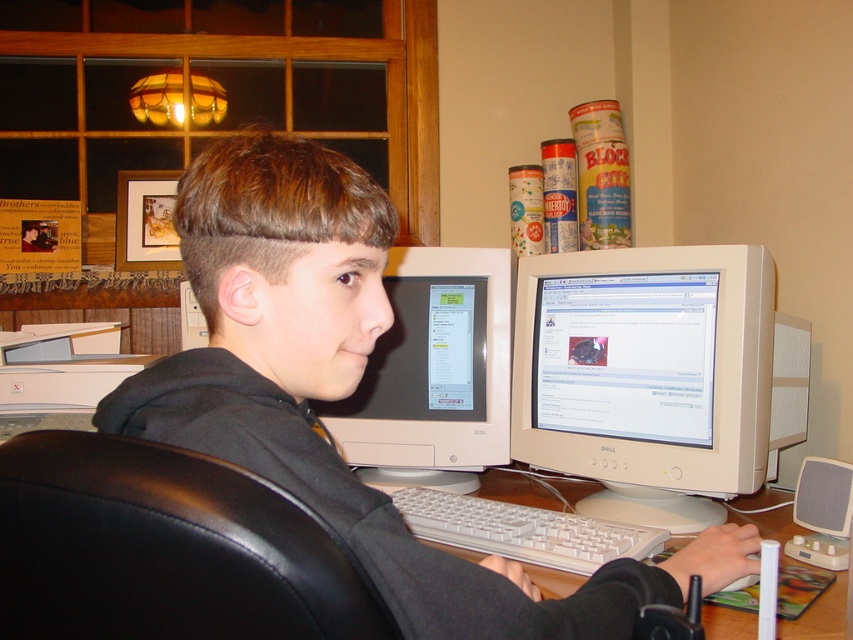
Based on the photo, which is more to the right, matte black hoodie at center or white glossy monitor at center?

matte black hoodie at center

Is point (567, 616) in front of point (480, 369)?

Yes, it is in front of point (480, 369).

The width and height of the screenshot is (853, 640). I want to click on matte black hoodie at center, so click(344, 392).

Can you confirm if matte black hoodie at center is shorter than white plastic monitor at center?

Incorrect, matte black hoodie at center's height does not fall short of white plastic monitor at center's.

Image resolution: width=853 pixels, height=640 pixels. I want to click on matte black hoodie at center, so click(344, 392).

In order to click on matte black hoodie at center in this screenshot , I will do `click(344, 392)`.

Is white glossy monitor at center below wooden desk at center?

Incorrect, white glossy monitor at center is not positioned below wooden desk at center.

Is white glossy monitor at center closer to the viewer compared to wooden desk at center?

That is False.

Where is `white glossy monitor at center`? Image resolution: width=853 pixels, height=640 pixels. white glossy monitor at center is located at coordinates (434, 372).